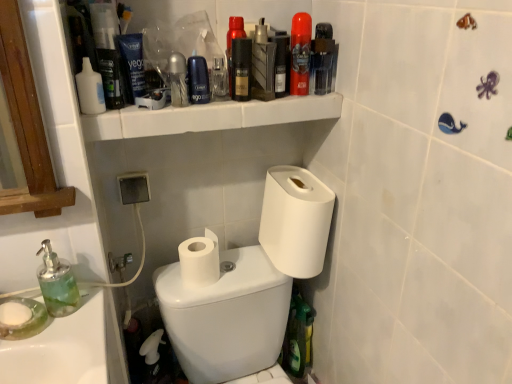
Locate an element on the screen. The height and width of the screenshot is (384, 512). vacant region in front of translucent green soap dispenser at lower left is located at coordinates (57, 343).